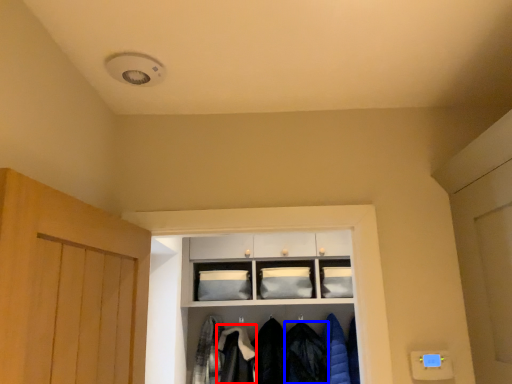
Question: Which object is further to the camera taking this photo, clothing (highlighted by a red box) or clothing (highlighted by a blue box)?

Choices:
 (A) clothing
 (B) clothing

Answer: (B)